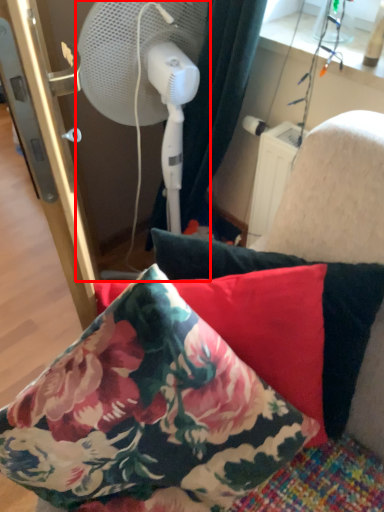
Question: From the image's perspective, where is mechanical fan (annotated by the red box) located relative to pillow?

Choices:
 (A) above
 (B) below

Answer: (A)